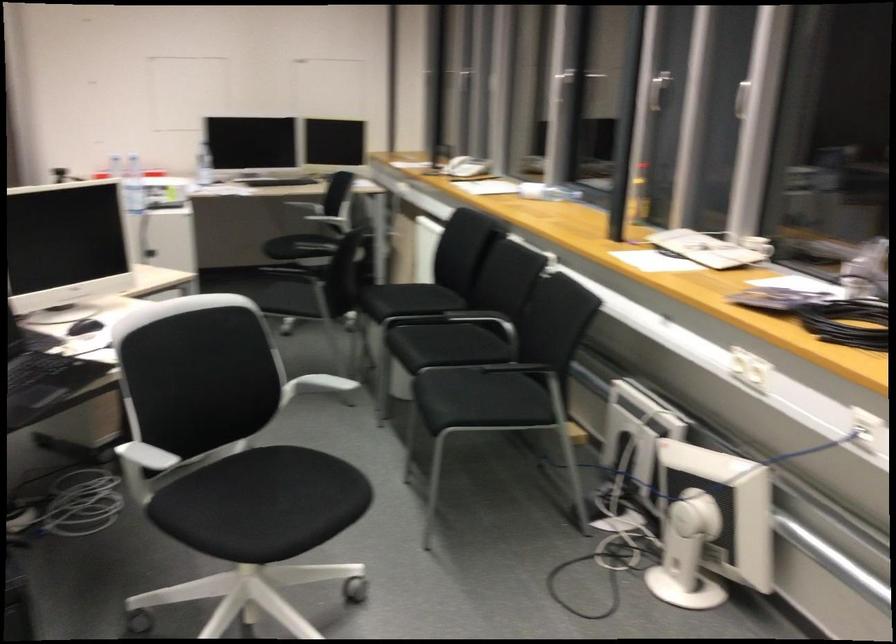
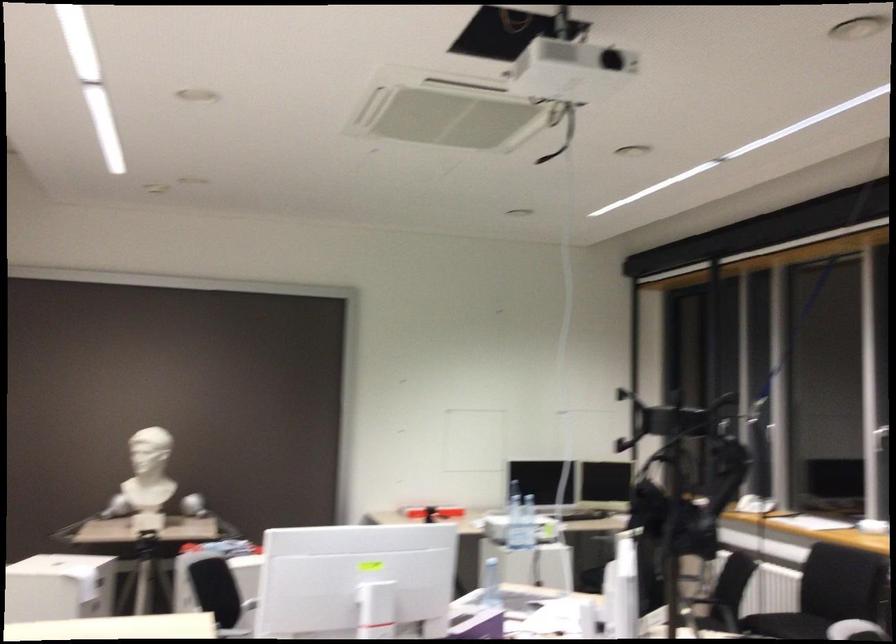
Question: In a continuous first-person perspective shot, in which direction is the camera moving?

Choices:
 (A) Left
 (B) Right
 (C) Forward
 (D) Backward

Answer: (A)